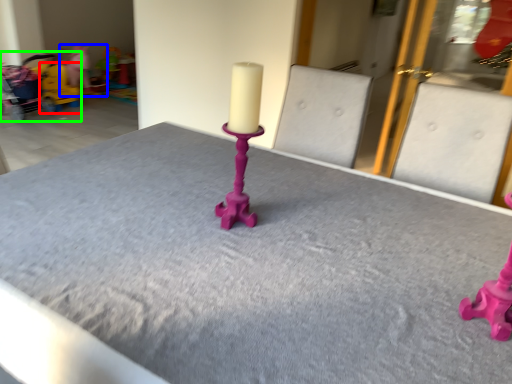
Question: Which object is positioned closest to toy (highlighted by a red box)? Select from toy (highlighted by a blue box) and baby carriage (highlighted by a green box).

Choices:
 (A) toy
 (B) baby carriage

Answer: (B)